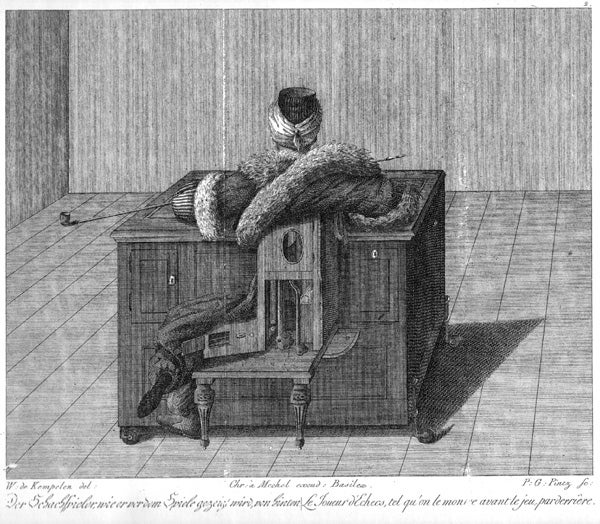
The height and width of the screenshot is (524, 600). I want to click on wall, so click(474, 109), click(18, 127).